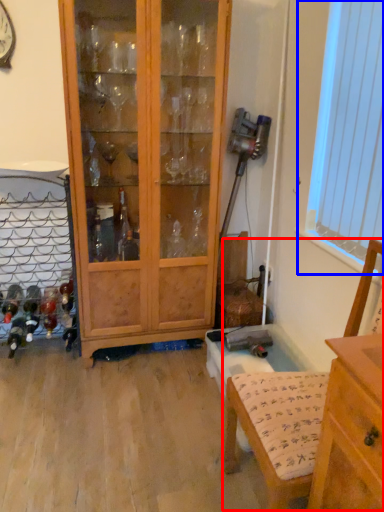
Question: Among these objects, which one is nearest to the camera, armchair (highlighted by a red box) or window screen (highlighted by a blue box)?

Choices:
 (A) armchair
 (B) window screen

Answer: (A)